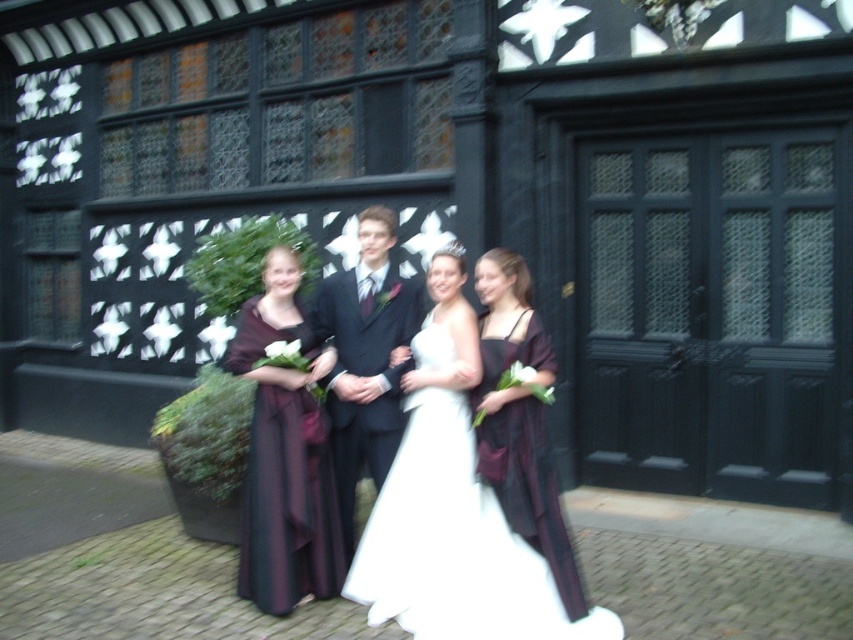
Question: Which point is closer to the camera?

Choices:
 (A) white satin dress at center
 (B) matte burgundy dress at center
 (C) dark suit at center

Answer: (A)

Question: Can you confirm if black wooden door at center is positioned below white satin dress at center?

Choices:
 (A) no
 (B) yes

Answer: (A)

Question: Is black wooden door at center in front of white satin dress at center?

Choices:
 (A) no
 (B) yes

Answer: (A)

Question: Can you confirm if white satin dress at center is positioned to the right of dark purple satin dress at center?

Choices:
 (A) no
 (B) yes

Answer: (B)

Question: Which object is farther from the camera taking this photo?

Choices:
 (A) dark purple satin dress at center
 (B) matte burgundy dress at center
 (C) dark suit at center
 (D) white satin dress at center

Answer: (C)

Question: Considering the real-world distances, which object is farthest from the black wooden door at center?

Choices:
 (A) dark purple satin dress at center
 (B) matte burgundy dress at center
 (C) dark suit at center
 (D) white satin dress at center

Answer: (A)